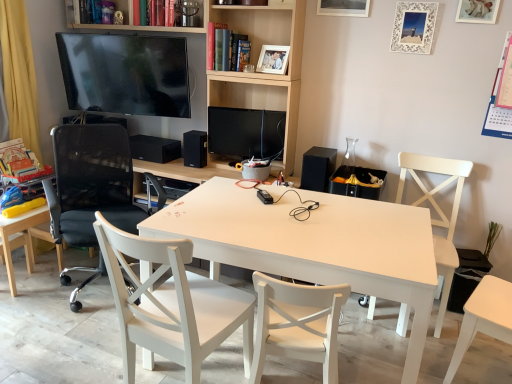
The image size is (512, 384). Identify the location of free point below black mesh office chair at left, the fourth chair from the right (from a real-world perspective). (92, 289).